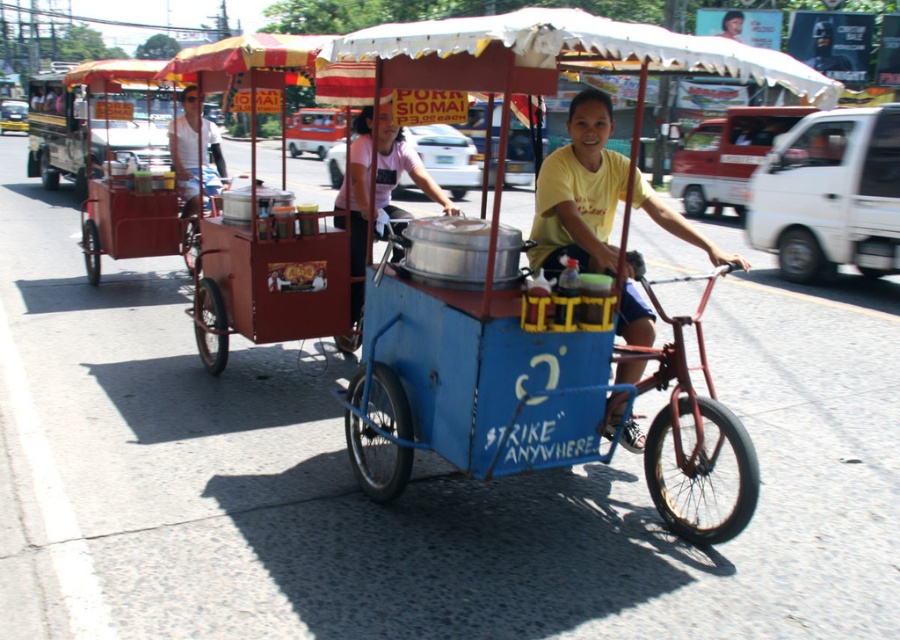
Question: Which of the following is the closest to the observer?

Choices:
 (A) white matte shirt at upper left
 (B) yellow matte shirt at center

Answer: (B)

Question: Is matte red cart at left below yellow matte shirt at center?

Choices:
 (A) yes
 (B) no

Answer: (B)

Question: Which object appears closest to the camera in this image?

Choices:
 (A) metallic silver pot at center
 (B) matte red cart at left
 (C) white matte shirt at upper left

Answer: (A)

Question: Does yellow matte shirt at center have a larger size compared to metallic silver pot at center?

Choices:
 (A) yes
 (B) no

Answer: (B)

Question: Which object is positioned closest to the matte red cart at left?

Choices:
 (A) metallic silver pot at center
 (B) white matte shirt at upper left

Answer: (B)

Question: Does matte red cart at left lie behind white matte shirt at upper left?

Choices:
 (A) yes
 (B) no

Answer: (B)